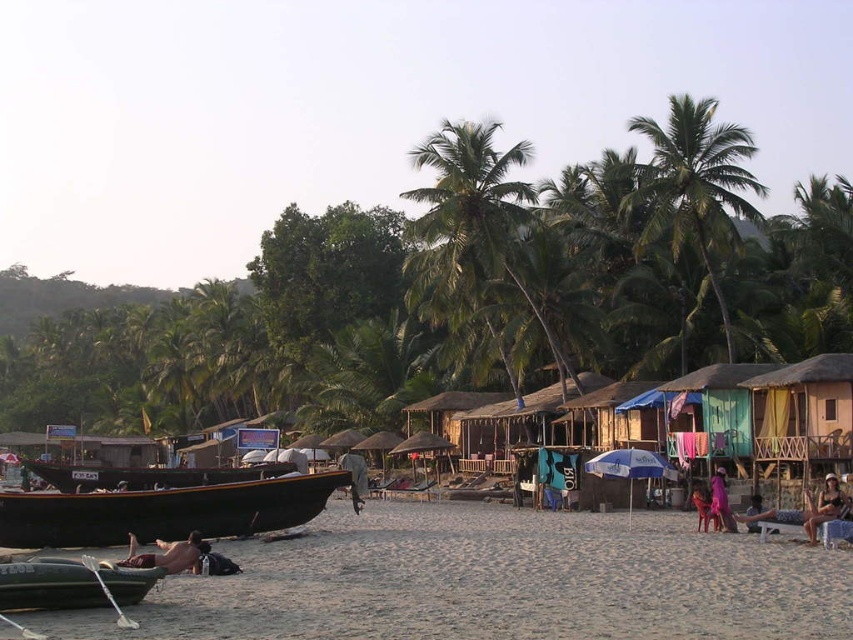
Question: Which object is farther from the camera taking this photo?

Choices:
 (A) skinny man at lower left
 (B) smooth sand beach at lower center
 (C) matte black bikini at lower right

Answer: (C)

Question: Which object is farther from the camera taking this photo?

Choices:
 (A) skinny man at lower left
 (B) pink fabric at center
 (C) beige fabric chair at lower right
 (D) smooth sand beach at lower center

Answer: (B)

Question: Estimate the real-world distances between objects in this image. Which object is farther from the green leafy palm tree at upper right?

Choices:
 (A) green rubber boat at lower left
 (B) green leafy palm tree at center
 (C) skinny man at lower left

Answer: (A)

Question: Can you confirm if green rubber boat at lower left is positioned below skinny man at lower left?

Choices:
 (A) yes
 (B) no

Answer: (B)

Question: Can you confirm if green leafy palm tree at upper right is bigger than pink fabric at center?

Choices:
 (A) yes
 (B) no

Answer: (A)

Question: Does smooth sand beach at lower center appear on the left side of beige fabric chair at lower right?

Choices:
 (A) no
 (B) yes

Answer: (B)